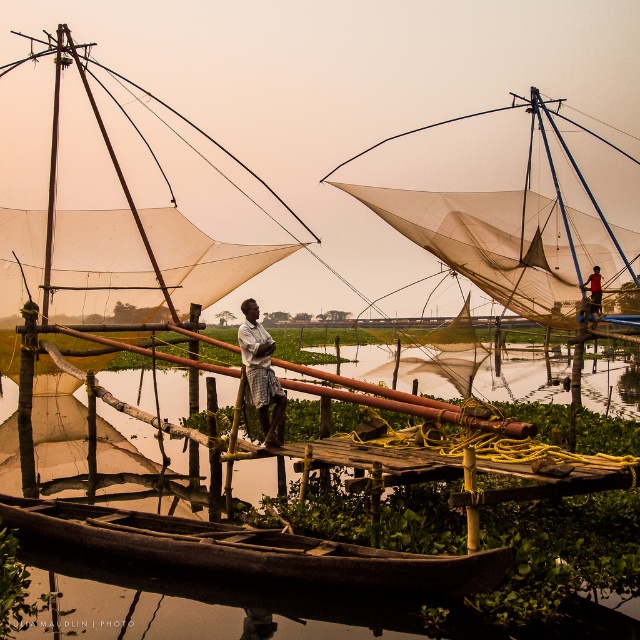
Question: Where is brown wooden waterway at center located in relation to dark brown wooden canoe at lower center in the image?

Choices:
 (A) left
 (B) right

Answer: (A)

Question: Which of the following is the farthest from the observer?

Choices:
 (A) (225, 556)
 (B) (410, 564)
 (C) (600, 301)

Answer: (C)

Question: Considering the real-world distances, which object is farthest from the checkered fabric fisherman at center?

Choices:
 (A) brown wooden waterway at center
 (B) dark brown wooden canoe at lower center
 (C) orange fabric fisherman at right

Answer: (C)

Question: Considering the relative positions of dark brown wooden canoe at lower center and checkered fabric fisherman at center in the image provided, where is dark brown wooden canoe at lower center located with respect to checkered fabric fisherman at center?

Choices:
 (A) above
 (B) below

Answer: (B)

Question: Which object is closer to the camera taking this photo?

Choices:
 (A) checkered fabric fisherman at center
 (B) dark brown wooden canoe at lower center

Answer: (B)

Question: Is checkered fabric fisherman at center above orange fabric fisherman at right?

Choices:
 (A) no
 (B) yes

Answer: (A)